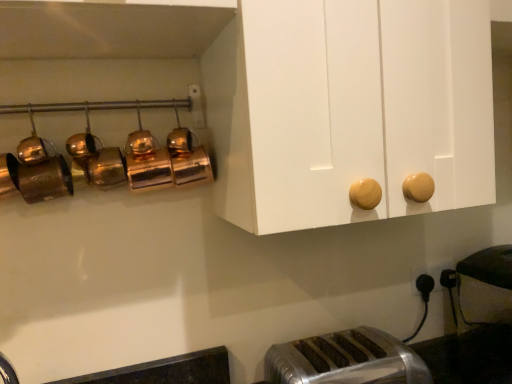
Question: Should I look upward or downward to see silver metallic toaster at lower center?

Choices:
 (A) up
 (B) down

Answer: (B)

Question: Can you confirm if black plastic outlet at lower right is smaller than silver metallic toaster at lower center?

Choices:
 (A) yes
 (B) no

Answer: (A)

Question: Is black plastic outlet at lower right in contact with silver metallic toaster at lower center?

Choices:
 (A) no
 (B) yes

Answer: (A)

Question: From the image's perspective, is black plastic outlet at lower right under silver metallic toaster at lower center?

Choices:
 (A) yes
 (B) no

Answer: (B)

Question: Is black plastic outlet at lower right closer to the viewer compared to silver metallic toaster at lower center?

Choices:
 (A) yes
 (B) no

Answer: (B)

Question: Would you consider black plastic outlet at lower right to be distant from silver metallic toaster at lower center?

Choices:
 (A) no
 (B) yes

Answer: (A)

Question: Is black plastic outlet at lower right facing away from silver metallic toaster at lower center?

Choices:
 (A) no
 (B) yes

Answer: (A)

Question: Does silver metallic toaster at lower center contain black plastic outlet at lower right?

Choices:
 (A) yes
 (B) no

Answer: (B)

Question: Is silver metallic toaster at lower center facing away from black plastic outlet at lower right?

Choices:
 (A) yes
 (B) no

Answer: (B)

Question: From the image's perspective, is silver metallic toaster at lower center located above black plastic outlet at lower right?

Choices:
 (A) yes
 (B) no

Answer: (B)

Question: Is silver metallic toaster at lower center further to camera compared to black plastic outlet at lower right?

Choices:
 (A) no
 (B) yes

Answer: (A)

Question: Is silver metallic toaster at lower center smaller than black plastic outlet at lower right?

Choices:
 (A) yes
 (B) no

Answer: (B)

Question: Can you confirm if silver metallic toaster at lower center is wider than black plastic outlet at lower right?

Choices:
 (A) no
 (B) yes

Answer: (B)

Question: From the image's perspective, is silver metallic toaster at lower center positioned above or below black plastic outlet at lower right?

Choices:
 (A) below
 (B) above

Answer: (A)